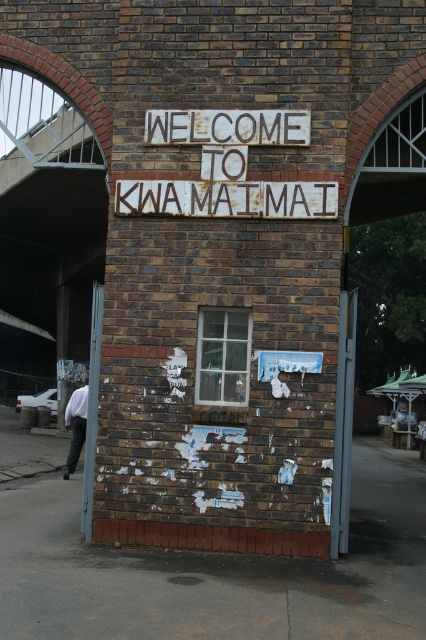
Between metallic gray door at left and white shirt at lower left, which one appears on the left side from the viewer's perspective?

From the viewer's perspective, white shirt at lower left appears more on the left side.

Does point (97, 291) lie behind point (65, 474)?

No, it is in front of (65, 474).

Where is `metallic gray door at left`? metallic gray door at left is located at coordinates (92, 410).

Locate an element on the screen. Image resolution: width=426 pixels, height=640 pixels. metallic gray door at left is located at coordinates (92, 410).

Can you confirm if white painted wood sign at center is wider than metallic gray door at left?

Correct, the width of white painted wood sign at center exceeds that of metallic gray door at left.

Between white painted wood sign at center and metallic gray door at left, which one has more height?

metallic gray door at left is taller.

Locate an element on the screen. white painted wood sign at center is located at coordinates (227, 198).

Identify the location of white painted wood sign at center. (227, 198).

Between white painted wood sign at center and white painted wood sign at upper center, which one has less height?

white painted wood sign at center

Can you confirm if white painted wood sign at center is taller than white painted wood sign at upper center?

No.

Locate an element on the screen. white painted wood sign at center is located at coordinates (227, 198).

The image size is (426, 640). Find the location of `white painted wood sign at center`. white painted wood sign at center is located at coordinates (227, 198).